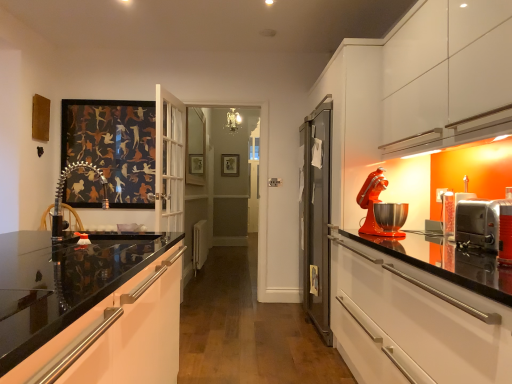
Measure the distance between point [496,210] and camera.

The distance of point [496,210] from camera is 1.48 meters.

What is the approximate width of clear glass mirror at center?

It is 1.88 inches.

In order to face clear glass mirror at center, should I rotate leftwards or rightwards?

To face it directly, rotate left by 7.800 degrees.

Image resolution: width=512 pixels, height=384 pixels. Describe the element at coordinates (62, 196) in the screenshot. I see `metallic silver chair at left` at that location.

In order to click on metallic silver chair at left in this screenshot , I will do `click(62, 196)`.

This screenshot has height=384, width=512. I want to click on gold metallic picture frame at center, so click(x=230, y=165).

What do you see at coordinates (89, 309) in the screenshot? I see `glossy white cabinet at lower left` at bounding box center [89, 309].

Identify the location of metallic silver toaster at right, the second appliance from the front. (451, 211).

The image size is (512, 384). Describe the element at coordinates (451, 211) in the screenshot. I see `metallic silver toaster at right, the second appliance from the front` at that location.

Find the location of a particular element. Image resolution: width=512 pixels, height=384 pixels. stainless steel toaster oven at right, acting as the 2th appliance starting from the back is located at coordinates (478, 223).

Does glossy white cabinet at lower left appear on the right side of clear glass mirror at center?

Indeed, glossy white cabinet at lower left is positioned on the right side of clear glass mirror at center.

Does glossy white cabinet at lower left have a lesser height compared to clear glass mirror at center?

Indeed, glossy white cabinet at lower left has a lesser height compared to clear glass mirror at center.

Which of these two, glossy white cabinet at lower left or clear glass mirror at center, is wider?

glossy white cabinet at lower left is wider.

Are clear glass mirror at center and gold metallic picture frame at center making contact?

They are not placed beside each other.

Does clear glass mirror at center come in front of gold metallic picture frame at center?

Yes.

Measure the distance from clear glass mirror at center to gold metallic picture frame at center.

31.90 inches.

In the scene shown: Is clear glass mirror at center to the left or to the right of gold metallic picture frame at center in the image?

clear glass mirror at center is to the left of gold metallic picture frame at center.

Who is smaller, stainless steel toaster oven at right, the 1th appliance in the front-to-back sequence, or gold metallic picture frame at center?

gold metallic picture frame at center is smaller.

Which is closer to the camera, (x=470, y=227) or (x=234, y=176)?

Point (x=470, y=227) appears to be closer to the viewer than point (x=234, y=176).

Is stainless steel toaster oven at right, the 1th appliance in the front-to-back sequence, in front of or behind gold metallic picture frame at center in the image?

Visually, stainless steel toaster oven at right, the 1th appliance in the front-to-back sequence, is located in front of gold metallic picture frame at center.

Does metallic silver toaster at right, the second appliance from the front, come behind gold metallic picture frame at center?

No, metallic silver toaster at right, the second appliance from the front, is closer to the camera.

Can you tell me how much metallic silver toaster at right, marked as the first appliance in a back-to-front arrangement, and gold metallic picture frame at center differ in facing direction?

88.5 degrees separate the facing orientations of metallic silver toaster at right, marked as the first appliance in a back-to-front arrangement, and gold metallic picture frame at center.

From a real-world perspective, which object stands above the other?

gold metallic picture frame at center is physically above.

Considering the relative sizes of metallic silver toaster at right, the second appliance from the front, and gold metallic picture frame at center in the image provided, is metallic silver toaster at right, the second appliance from the front, smaller than gold metallic picture frame at center?

Indeed, metallic silver toaster at right, the second appliance from the front, has a smaller size compared to gold metallic picture frame at center.

The height and width of the screenshot is (384, 512). What are the coordinates of `chair located above the glossy white cabinet at lower left (from a real-world perspective)` in the screenshot? It's located at (62, 196).

Considering the sizes of objects metallic silver chair at left and glossy white cabinet at lower left in the image provided, who is taller, metallic silver chair at left or glossy white cabinet at lower left?

glossy white cabinet at lower left.

Which is behind, metallic silver chair at left or glossy white cabinet at lower left?

metallic silver chair at left is further away from the camera.

Based on the photo, considering the sizes of metallic silver chair at left and glossy white cabinet at lower left in the image, is metallic silver chair at left wider or thinner than glossy white cabinet at lower left?

Clearly, metallic silver chair at left has less width compared to glossy white cabinet at lower left.

Can you confirm if metallic silver toaster at right, marked as the first appliance in a back-to-front arrangement, is positioned to the left of metallic silver chair at left?

In fact, metallic silver toaster at right, marked as the first appliance in a back-to-front arrangement, is to the right of metallic silver chair at left.

Is metallic silver toaster at right, the second appliance from the front, positioned with its back to metallic silver chair at left?

No, metallic silver chair at left is not at the back of metallic silver toaster at right, the second appliance from the front.

Are metallic silver toaster at right, marked as the first appliance in a back-to-front arrangement, and metallic silver chair at left beside each other?

No, metallic silver toaster at right, marked as the first appliance in a back-to-front arrangement, is not next to metallic silver chair at left.

What are the coordinates of `home appliance below the metallic silver chair at left (from the image's perspective)` in the screenshot? It's located at (379, 202).

From a real-world perspective, is metallic silver chair at left over matte orange mixer at right?

No, from a real-world perspective, metallic silver chair at left is not on top of matte orange mixer at right.

Based on their sizes in the image, would you say metallic silver chair at left is bigger or smaller than matte orange mixer at right?

Clearly, metallic silver chair at left is smaller in size than matte orange mixer at right.

Is metallic silver chair at left surrounding matte orange mixer at right?

No, matte orange mixer at right is not a part of metallic silver chair at left.

At what (x,y) coordinates should I click in order to perform the action: click on window above the glossy white cabinet at lower left (from a real-world perspective). Please return your answer as a coordinate pair (x, y). Looking at the image, I should click on (195, 147).

What are the coordinates of `picture frame on the right of clear glass mirror at center` in the screenshot? It's located at (230, 165).

Considering their positions, is clear glass mirror at center positioned further to metallic silver chair at left than metallic silver toaster at right, marked as the first appliance in a back-to-front arrangement?

metallic silver toaster at right, marked as the first appliance in a back-to-front arrangement, is further to metallic silver chair at left.

Based on their spatial positions, is glossy white cabinet at lower left or stainless steel toaster oven at right, acting as the 2th appliance starting from the back, further from gold metallic picture frame at center?

The object further to gold metallic picture frame at center is stainless steel toaster oven at right, acting as the 2th appliance starting from the back.

Which object lies further to the anchor point clear glass mirror at center, glossy white cabinet at lower left or matte orange mixer at right?

glossy white cabinet at lower left lies further to clear glass mirror at center than the other object.

Considering their positions, is matte orange mixer at right positioned further to gold metallic picture frame at center than metallic silver toaster at right, the second appliance from the front?

metallic silver toaster at right, the second appliance from the front, lies further to gold metallic picture frame at center than the other object.

When comparing their distances from glossy white cabinet at lower left, does metallic silver toaster at right, the second appliance from the front, or matte orange mixer at right seem further?

metallic silver toaster at right, the second appliance from the front, is further to glossy white cabinet at lower left.

Looking at the image, which one is located further to glossy white cabinet at lower left, matte orange mixer at right or stainless steel toaster oven at right, acting as the 2th appliance starting from the back?

stainless steel toaster oven at right, acting as the 2th appliance starting from the back, lies further to glossy white cabinet at lower left than the other object.

Which object lies further to the anchor point clear glass mirror at center, gold metallic picture frame at center or glossy white cabinet at lower left?

Among the two, glossy white cabinet at lower left is located further to clear glass mirror at center.

Estimate the real-world distances between objects in this image. Which object is closer to metallic silver toaster at right, the second appliance from the front, gold metallic picture frame at center or clear glass mirror at center?

clear glass mirror at center lies closer to metallic silver toaster at right, the second appliance from the front, than the other object.

The height and width of the screenshot is (384, 512). In order to click on home appliance positioned between metallic silver chair at left and clear glass mirror at center from near to far in this screenshot , I will do `click(379, 202)`.

Find the location of a particular element. Image resolution: width=512 pixels, height=384 pixels. home appliance between stainless steel toaster oven at right, acting as the 2th appliance starting from the back, and clear glass mirror at center, along the z-axis is located at coordinates (379, 202).

Where is `home appliance between metallic silver chair at left and gold metallic picture frame at center along the z-axis`? home appliance between metallic silver chair at left and gold metallic picture frame at center along the z-axis is located at coordinates (379, 202).

You are a GUI agent. You are given a task and a screenshot of the screen. Output one action in this format:
    pyautogui.click(x=<x>, y=<y>)
    Task: Click on the home appliance between metallic silver toaster at right, marked as the first appliance in a back-to-front arrangement, and clear glass mirror at center in the front-back direction
    
    Given the screenshot: What is the action you would take?
    pyautogui.click(x=379, y=202)